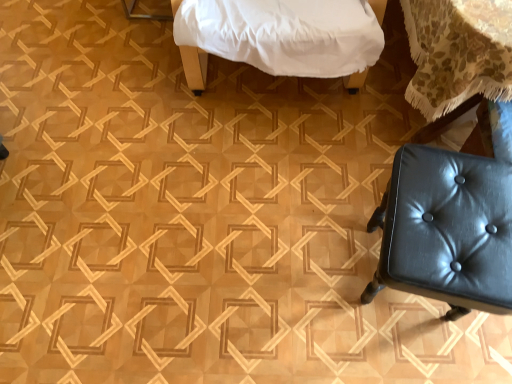
Question: Considering the relative positions of black leather stool at lower right and white fabric-covered bed at upper center in the image provided, is black leather stool at lower right in front of white fabric-covered bed at upper center?

Choices:
 (A) no
 (B) yes

Answer: (B)

Question: Is there a large distance between black leather stool at lower right and white fabric-covered bed at upper center?

Choices:
 (A) yes
 (B) no

Answer: (B)

Question: From a real-world perspective, is black leather stool at lower right over white fabric-covered bed at upper center?

Choices:
 (A) no
 (B) yes

Answer: (A)

Question: Can you confirm if black leather stool at lower right is positioned to the right of white fabric-covered bed at upper center?

Choices:
 (A) yes
 (B) no

Answer: (A)

Question: Does black leather stool at lower right have a lesser width compared to white fabric-covered bed at upper center?

Choices:
 (A) yes
 (B) no

Answer: (A)

Question: From a real-world perspective, is black leather stool at lower right below white fabric-covered bed at upper center?

Choices:
 (A) no
 (B) yes

Answer: (B)

Question: Considering the relative positions of white fabric-covered bed at upper center and black leather stool at lower right in the image provided, is white fabric-covered bed at upper center behind black leather stool at lower right?

Choices:
 (A) no
 (B) yes

Answer: (B)

Question: Does white fabric-covered bed at upper center turn towards black leather stool at lower right?

Choices:
 (A) yes
 (B) no

Answer: (A)

Question: Is white fabric-covered bed at upper center in front of black leather stool at lower right?

Choices:
 (A) no
 (B) yes

Answer: (A)

Question: Would you say white fabric-covered bed at upper center is a long distance from black leather stool at lower right?

Choices:
 (A) yes
 (B) no

Answer: (B)

Question: Is black leather stool at lower right surrounded by white fabric-covered bed at upper center?

Choices:
 (A) yes
 (B) no

Answer: (B)

Question: Does white fabric-covered bed at upper center appear on the right side of black leather stool at lower right?

Choices:
 (A) no
 (B) yes

Answer: (A)

Question: Relative to white fabric-covered bed at upper center, is black leather stool at lower right in front or behind?

Choices:
 (A) front
 (B) behind

Answer: (A)